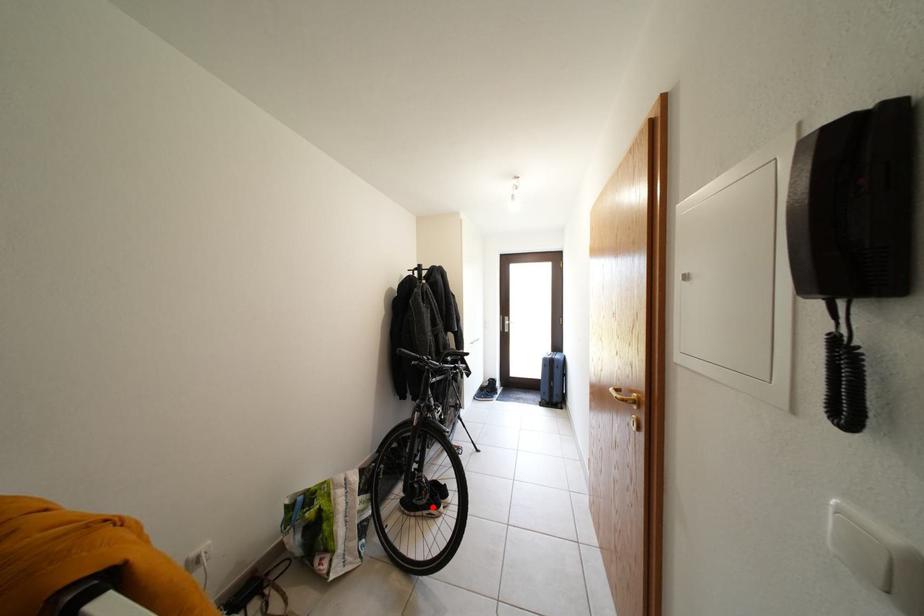
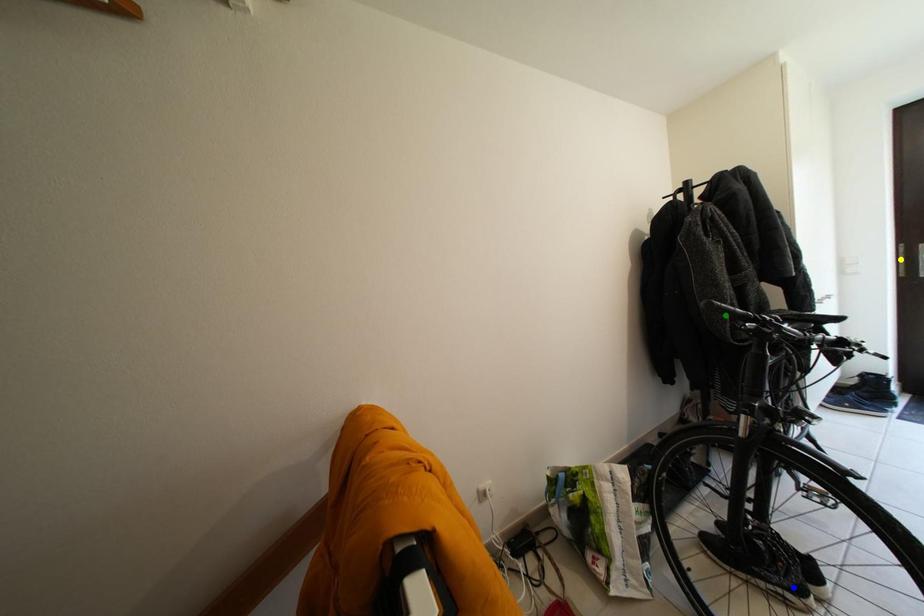
Question: I am providing you with two images of the same scene from different viewpoints. A red point is marked on the first image. You are given multiple points on the second image. Which spot in image 2 lines up with the point in image 1?

Choices:
 (A) green point
 (B) blue point
 (C) yellow point

Answer: (B)